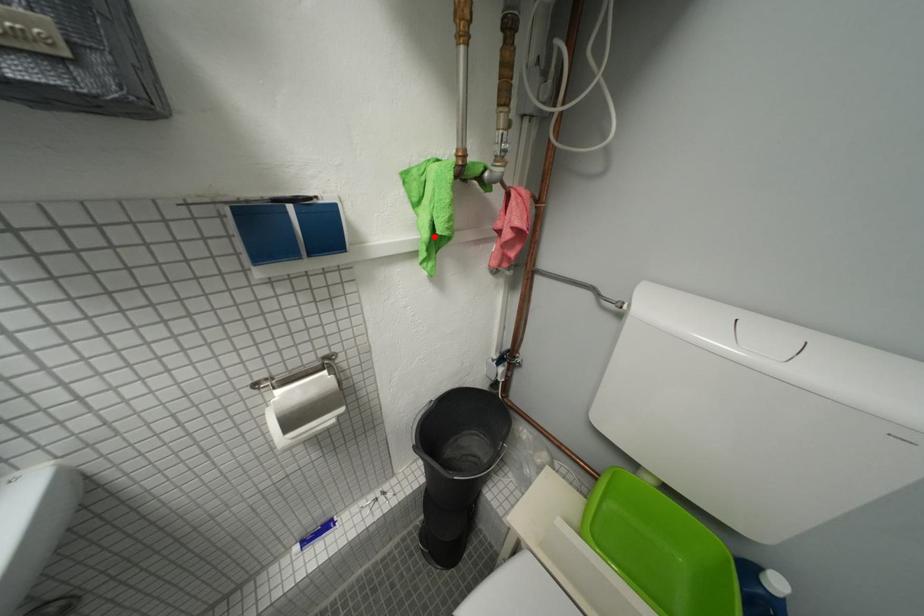
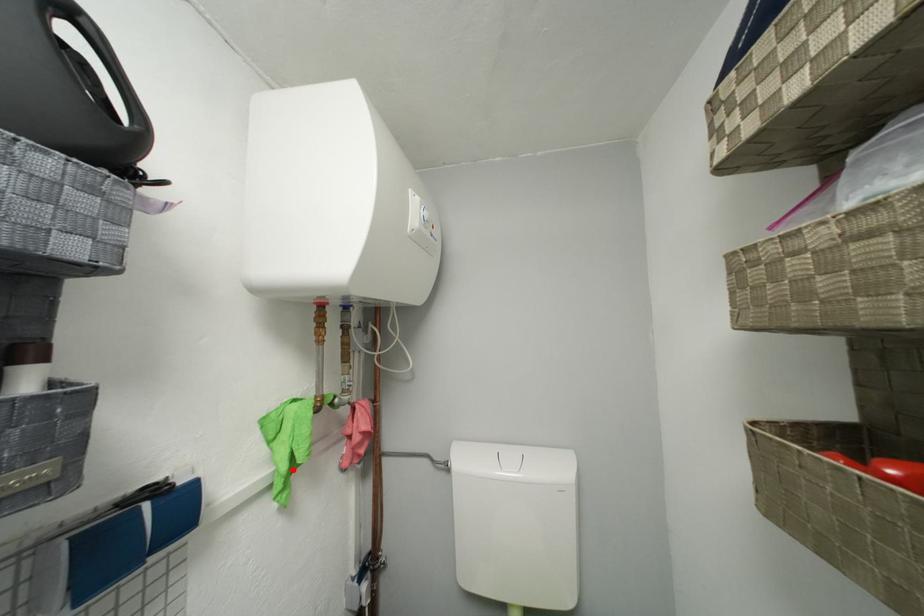
I am providing you with two images of the same scene from different viewpoints. A red point is marked on the first image and another point is marked on the second image. Is the marked point in image1 the same physical position as the marked point in image2?

Yes